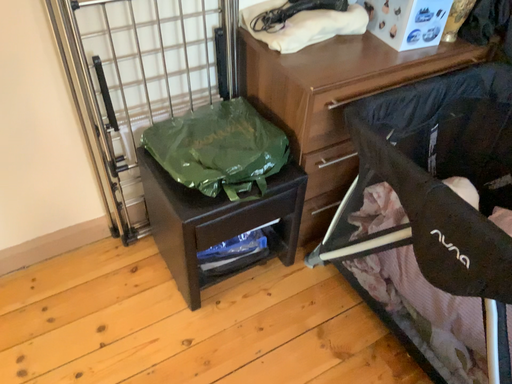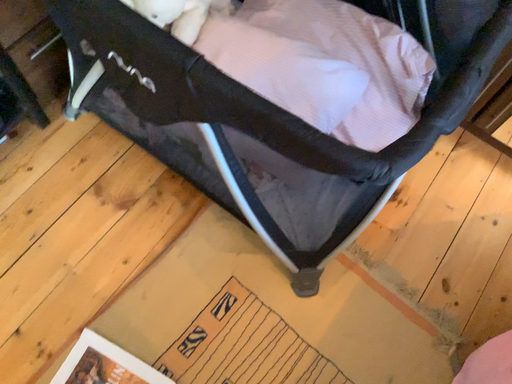
Question: Which way did the camera rotate in the video?

Choices:
 (A) rotated right
 (B) rotated left

Answer: (A)